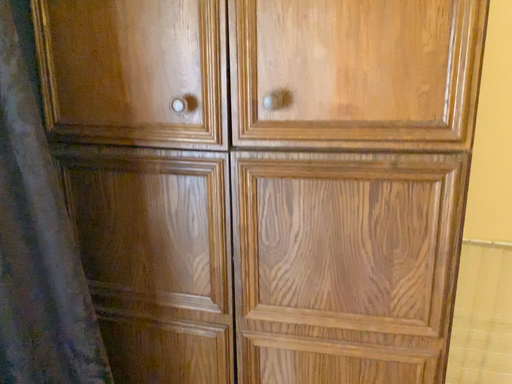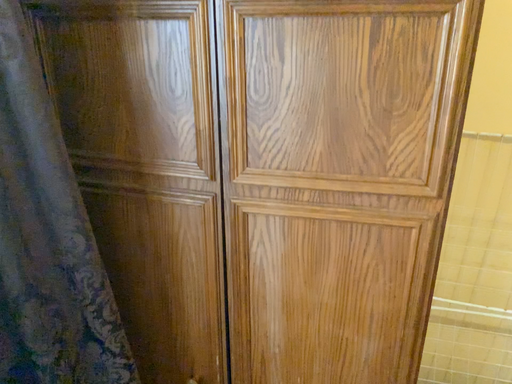
Question: How did the camera likely rotate when shooting the video?

Choices:
 (A) rotated downward
 (B) rotated upward

Answer: (A)